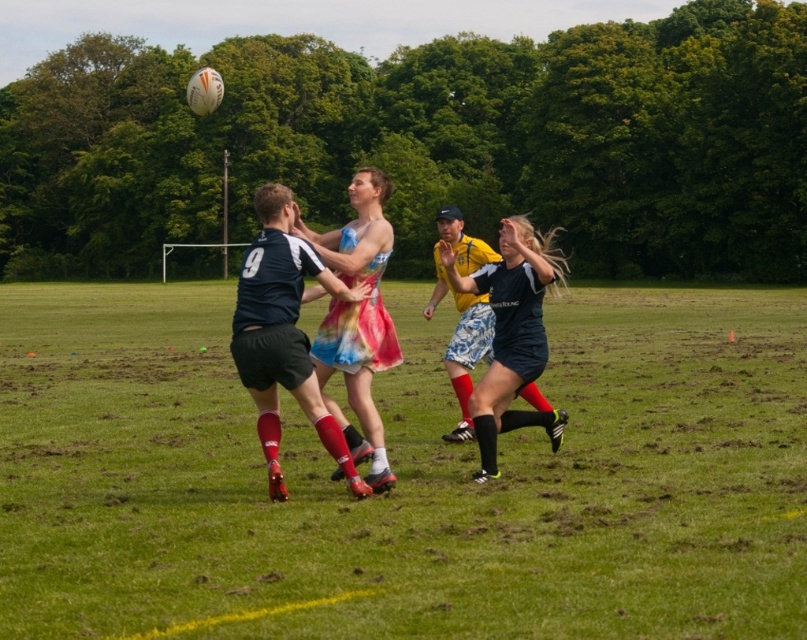
Can you confirm if green grass at center is taller than rainbow printed dress at center?

No.

Locate an element on the screen. This screenshot has height=640, width=807. green grass at center is located at coordinates (404, 477).

Between matte black shorts at center and matte black dress at center, which one is positioned higher?

matte black dress at center is above.

The height and width of the screenshot is (640, 807). Identify the location of matte black shorts at center. (283, 333).

Is green grass at center smaller than matte black shorts at center?

No, green grass at center is not smaller than matte black shorts at center.

Identify the location of green grass at center. This screenshot has height=640, width=807. (404, 477).

Describe the element at coordinates (404, 477) in the screenshot. I see `green grass at center` at that location.

In order to click on green grass at center in this screenshot , I will do `click(404, 477)`.